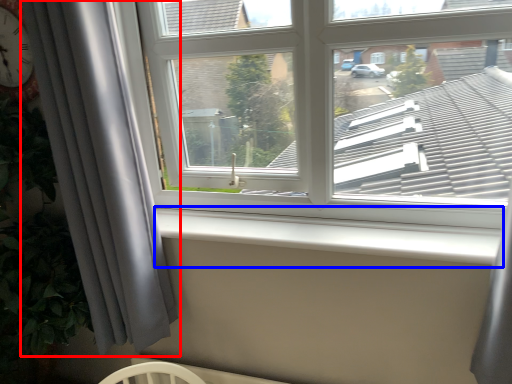
Question: Which object appears farthest to the camera in this image, curtain (highlighted by a red box) or window sill (highlighted by a blue box)?

Choices:
 (A) curtain
 (B) window sill

Answer: (B)